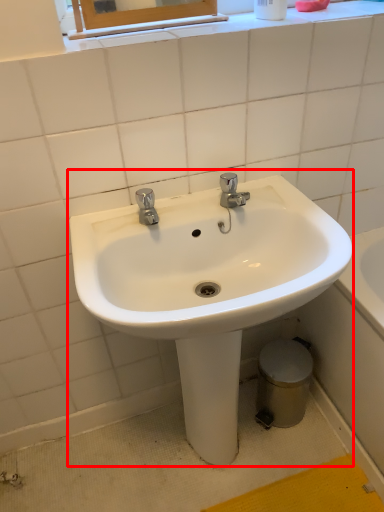
Question: From the image's perspective, what is the correct spatial relationship of sink (annotated by the red box) in relation to bidet?

Choices:
 (A) above
 (B) below

Answer: (A)